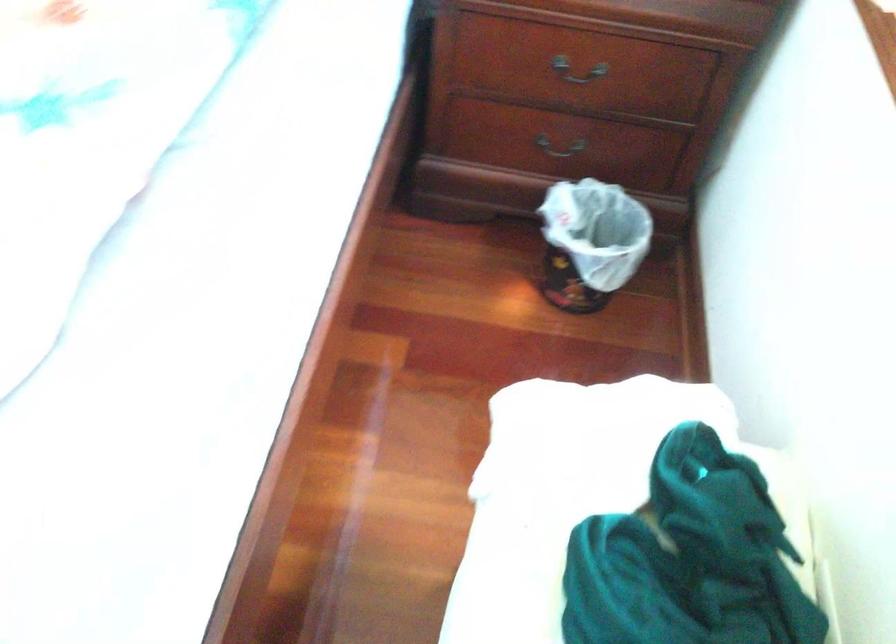
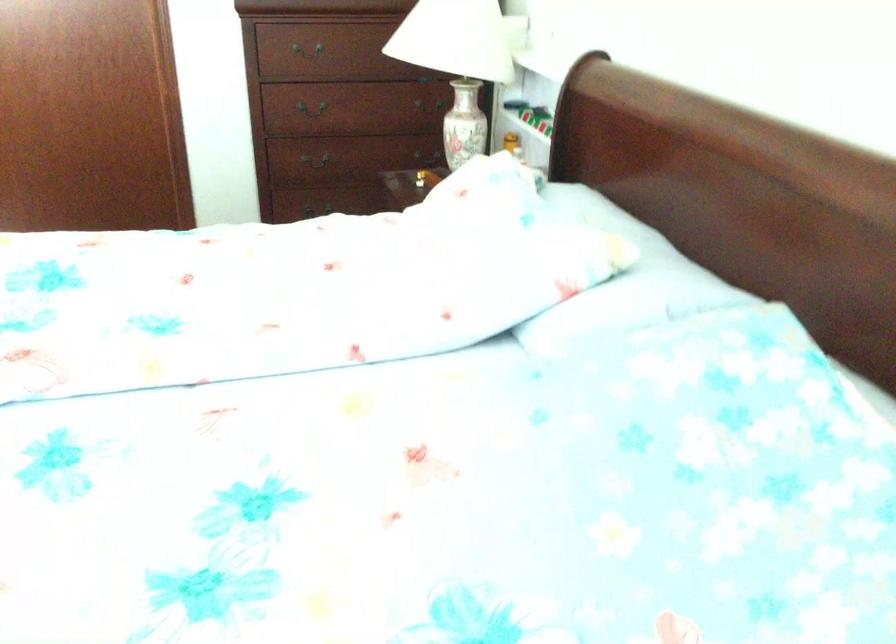
Question: The camera is either moving clockwise (left) or counter-clockwise (right) around the object. The first image is from the beginning of the video and the second image is from the end. Is the camera moving left or right when shooting the video?

Choices:
 (A) Left
 (B) Right

Answer: (B)